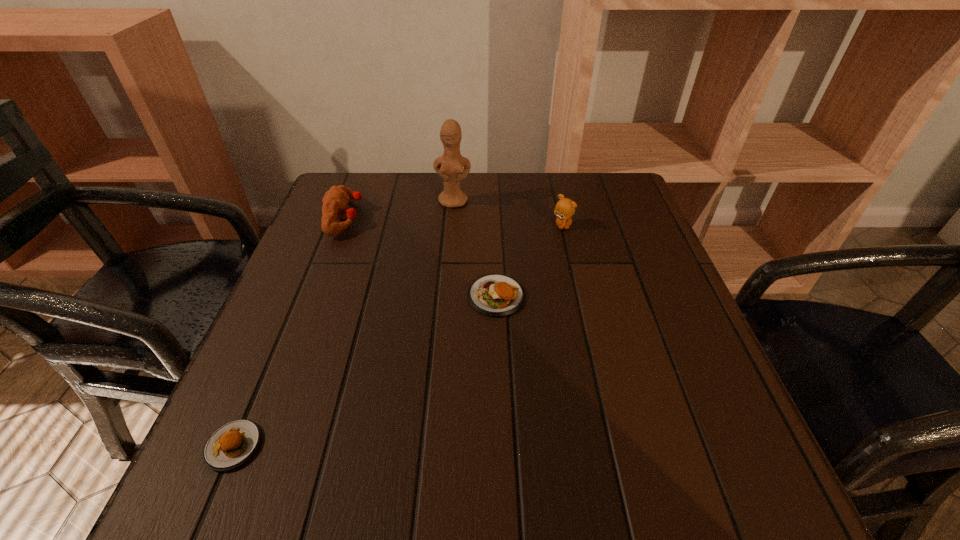
The image size is (960, 540). What are the coordinates of `free point that satisfies the following two spatial constraints: 1. on the front-facing side of the figurine; 2. with the gloves of the third tallest object facing forward` in the screenshot? It's located at (452, 218).

Locate an element on the screen. Image resolution: width=960 pixels, height=540 pixels. vacant region that satisfies the following two spatial constraints: 1. on the back side of the shortest object; 2. on the right side of the fourth tallest object is located at coordinates (297, 296).

Identify the location of vacant region that satisfies the following two spatial constraints: 1. on the front-facing side of the figurine; 2. with the gloves of the third tallest object facing forward. The height and width of the screenshot is (540, 960). (452, 218).

Find the location of a particular element. The width and height of the screenshot is (960, 540). vacant space that satisfies the following two spatial constraints: 1. with the gloves of the puncher facing forward; 2. on the back side of the right food is located at coordinates (316, 296).

What are the coordinates of `free space that satisfies the following two spatial constraints: 1. with the gloves of the second shortest object facing forward; 2. on the right side of the puncher` in the screenshot? It's located at (316, 296).